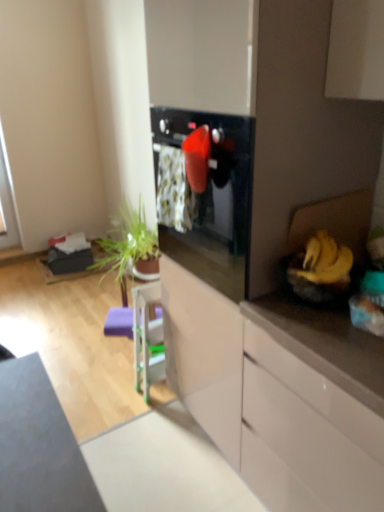
Question: Is point (306, 373) positioned closer to the camera than point (258, 367)?

Choices:
 (A) closer
 (B) farther

Answer: (A)

Question: Is white glossy dresser at center taller or shorter than white glossy cabinet at right, the 2th cabinetry viewed from the back?

Choices:
 (A) tall
 (B) short

Answer: (A)

Question: Estimate the real-world distances between objects in this image. Which object is farther from the white glossy dresser at center?

Choices:
 (A) white glossy cabinet at right, the 2th cabinetry viewed from the back
 (B) white glossy cabinet at center, arranged as the first cabinetry when viewed from the back
 (C) yellow matte banana at right

Answer: (C)

Question: Estimate the real-world distances between objects in this image. Which object is farther from the white glossy cabinet at center, arranged as the first cabinetry when viewed from the back?

Choices:
 (A) white glossy dresser at center
 (B) white glossy cabinet at right, which ranks as the first cabinetry in front-to-back order
 (C) yellow matte banana at right

Answer: (C)